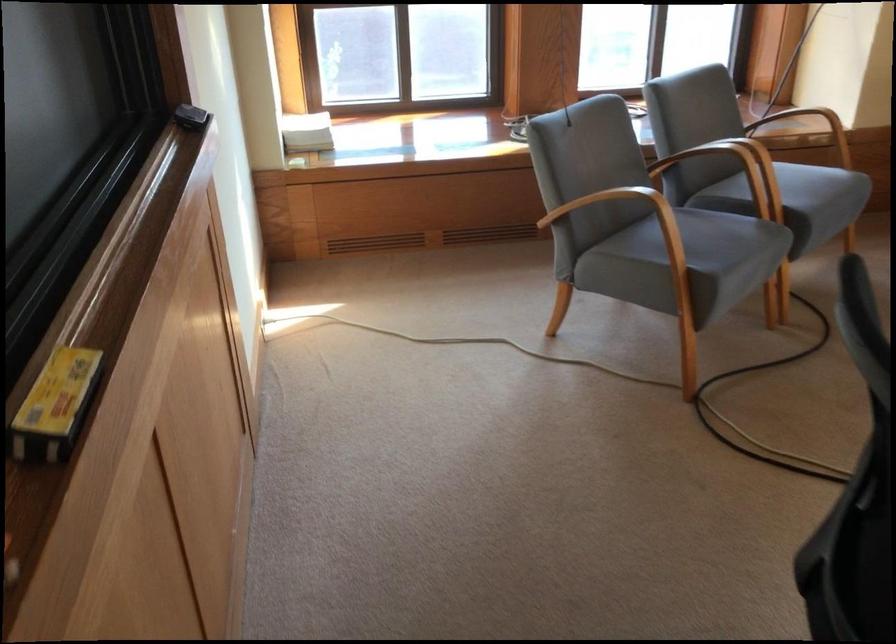
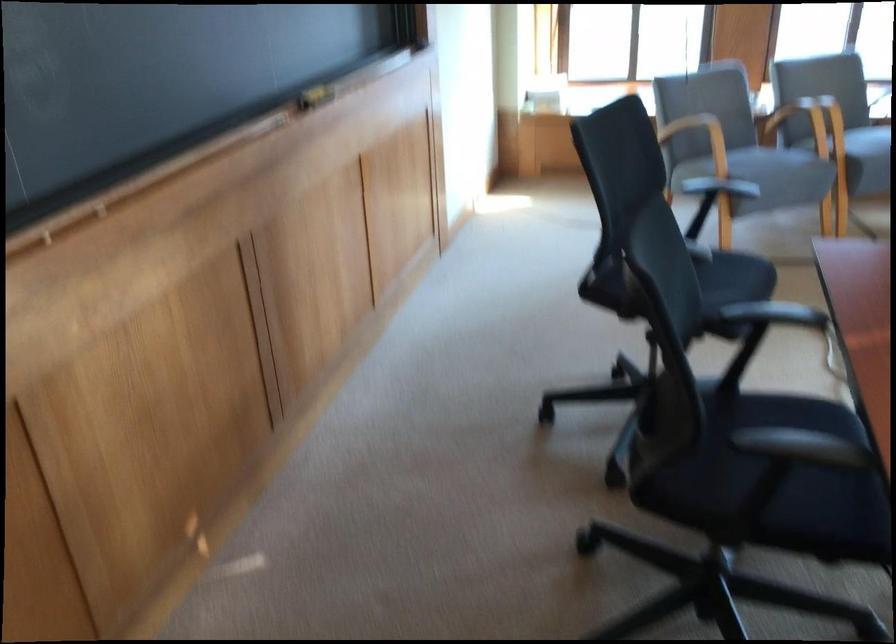
The point at (703, 184) is marked in the first image. Where is the corresponding point in the second image?

(799, 122)